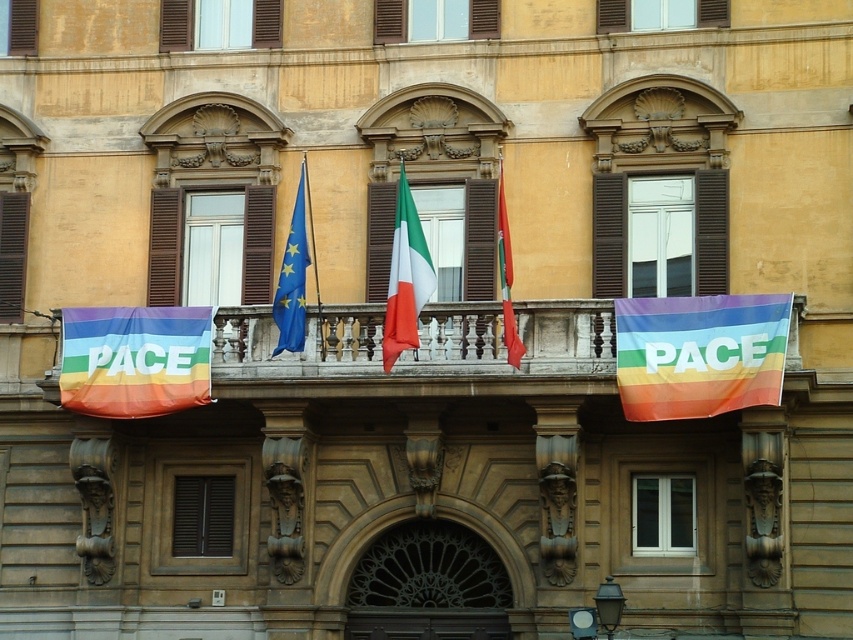
You are standing in front of the classical building and want to take a photo of the rainbow fabric banner at center. Your camera is 56.29 meters away from the banner. Is the camera close enough to capture the entire banner in the photo?

The rainbow fabric banner at center and camera are 56.29 meters apart, so the camera is exactly at the required distance to capture the entire banner in the photo.

You are standing in front of the classical building and notice the rainbow fabric banner at center. Where is it positioned relative to the European Union flag on the left?

The rainbow fabric banner at center is located at point (699, 353), which is to the right of the European Union flag on the left.

In the scene shown: You are standing in front of the classical building and want to take a photo of the flags on the balcony. Which flag, the rainbow fabric banner at left or the white cotton flag at center, will appear closer to you in the photo?

The rainbow fabric banner at left will appear closer to you in the photo because it is further to the viewer than the white cotton flag at center.